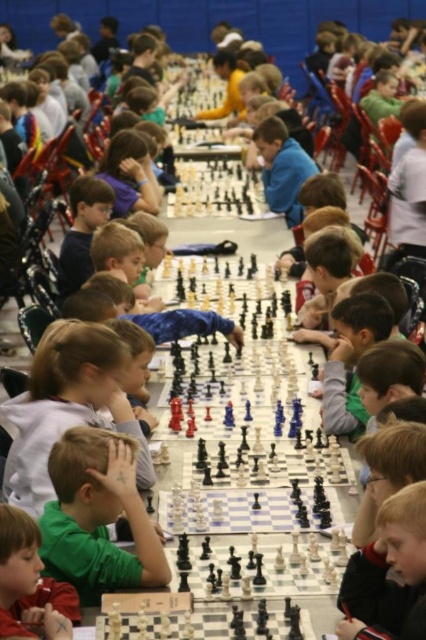
You are a photographer standing in the middle of the chess tournament hall. You want to take a photo of both the green matte shirt at center and the light brown hair at lower right. Which object should you focus on first to ensure both are in the frame?

You should focus on the green matte shirt at center first because it is closer to you than the light brown hair at lower right, so adjusting the camera to include it will also capture the latter.

You are a photographer trying to capture a photo of both light brown hair at lower right and light brown hair at lower left. Which one should you focus on first if you want to include both in the frame without moving the camera?

Since the light brown hair at lower right is positioned on the right side of light brown hair at lower left, you should focus on the light brown hair at lower left first to ensure both are in the frame without moving the camera.